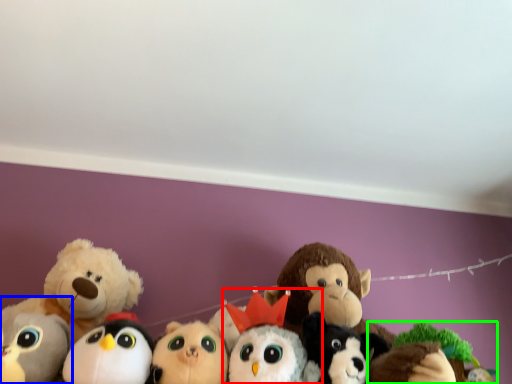
Question: Which object is the closest to the toy (highlighted by a red box)? Choose among these: toy (highlighted by a blue box) or toy (highlighted by a green box).

Choices:
 (A) toy
 (B) toy

Answer: (B)